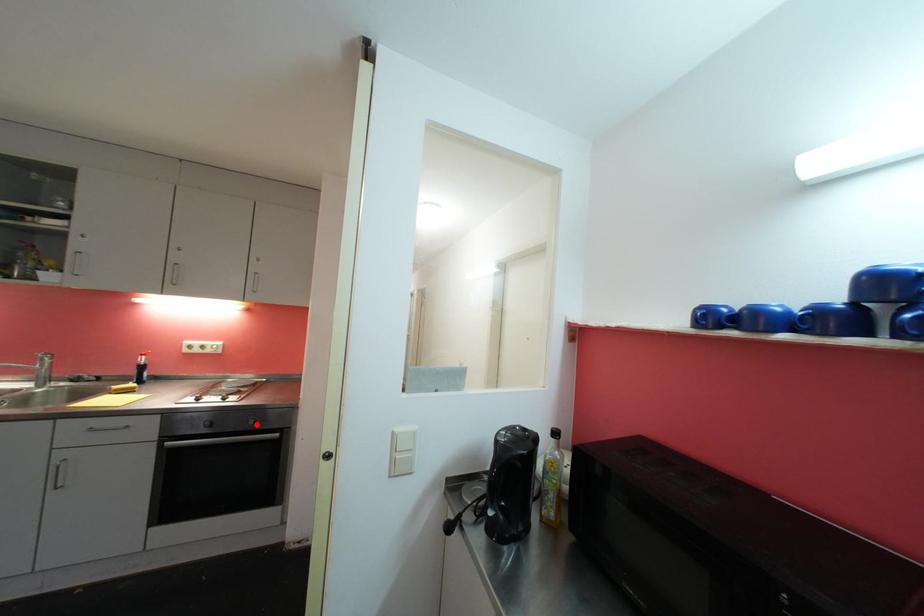
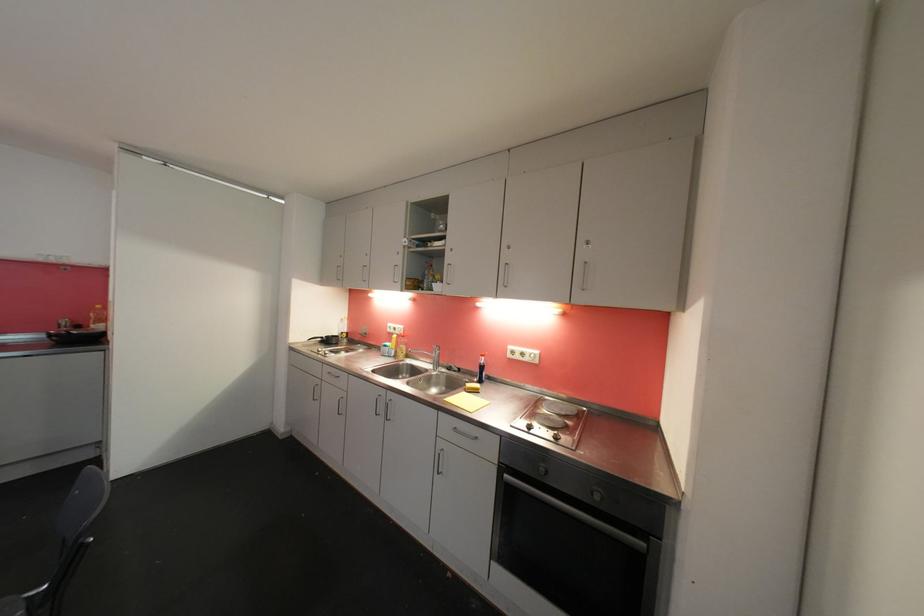
Where in the second image is the point corresponding to the highlighted location from the first image?

(602, 499)